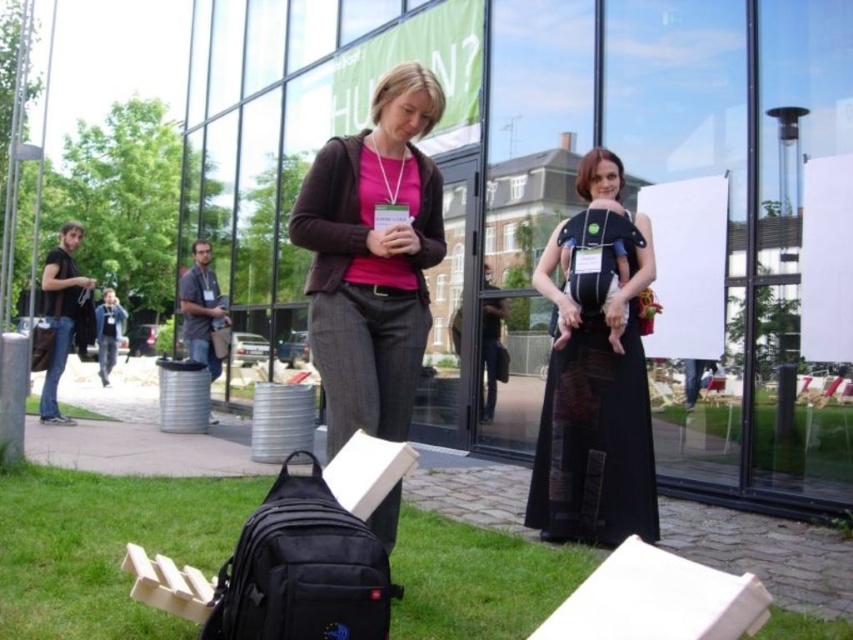
You are organizing a fashion show and need to decide which outfit to display first. The matte black jacket at center and the black cotton shirt at left are both options. Based on their sizes, which one should you choose if you want to start with the larger piece?

The black cotton shirt at left is larger than the matte black jacket at center, so you should choose the black cotton shirt at left to display first.

You are planning to place a rectangular box that is 1 meter wide between the green grass at lower left and the matte black jacket at center. Based on their widths, will the box fit between them without overlapping?

The green grass at lower left is wider than the matte black jacket at center. Since the box is 1 meter wide, it depends on the actual space between them. However, since the grass is wider, there might be enough space, but the exact fit cannot be determined without knowing the distance between them.